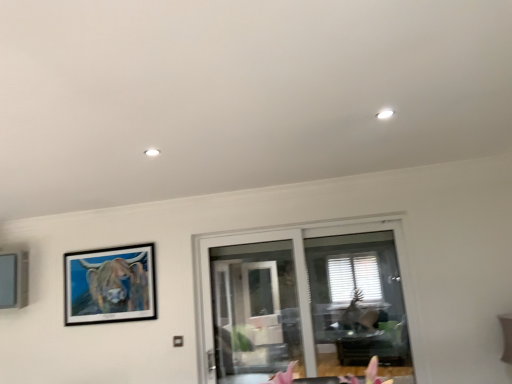
Question: Should I look upward or downward to see matte gray picture frame at left, which ranks as the second picture frame in right-to-left order?

Choices:
 (A) up
 (B) down

Answer: (B)

Question: From the image's perspective, is matte gray picture frame at left, which is the first picture frame in left-to-right order, above wooden-framed painting at upper left, marked as the 1th picture frame in a right-to-left arrangement?

Choices:
 (A) yes
 (B) no

Answer: (A)

Question: From a real-world perspective, is matte gray picture frame at left, which ranks as the second picture frame in right-to-left order, physically above wooden-framed painting at upper left, which ranks as the 2th picture frame in left-to-right order?

Choices:
 (A) no
 (B) yes

Answer: (B)

Question: Is matte gray picture frame at left, which is the first picture frame in left-to-right order, looking in the opposite direction of wooden-framed painting at upper left, marked as the 1th picture frame in a right-to-left arrangement?

Choices:
 (A) no
 (B) yes

Answer: (A)

Question: Is matte gray picture frame at left, which is the first picture frame in left-to-right order, at the right side of wooden-framed painting at upper left, marked as the 1th picture frame in a right-to-left arrangement?

Choices:
 (A) no
 (B) yes

Answer: (A)

Question: Considering the relative positions of matte gray picture frame at left, which is the first picture frame in left-to-right order, and wooden-framed painting at upper left, which ranks as the 2th picture frame in left-to-right order, in the image provided, is matte gray picture frame at left, which is the first picture frame in left-to-right order, to the left of wooden-framed painting at upper left, which ranks as the 2th picture frame in left-to-right order, from the viewer's perspective?

Choices:
 (A) no
 (B) yes

Answer: (B)

Question: Can we say matte gray picture frame at left, which ranks as the second picture frame in right-to-left order, lies outside wooden-framed painting at upper left, marked as the 1th picture frame in a right-to-left arrangement?

Choices:
 (A) no
 (B) yes

Answer: (B)

Question: Considering the relative sizes of wooden-framed painting at upper left, which ranks as the 2th picture frame in left-to-right order, and matte gray picture frame at left, which is the first picture frame in left-to-right order, in the image provided, is wooden-framed painting at upper left, which ranks as the 2th picture frame in left-to-right order, bigger than matte gray picture frame at left, which is the first picture frame in left-to-right order,?

Choices:
 (A) yes
 (B) no

Answer: (B)

Question: Is wooden-framed painting at upper left, marked as the 1th picture frame in a right-to-left arrangement, thinner than matte gray picture frame at left, which is the first picture frame in left-to-right order?

Choices:
 (A) yes
 (B) no

Answer: (A)

Question: Is wooden-framed painting at upper left, which ranks as the 2th picture frame in left-to-right order, at the right side of matte gray picture frame at left, which is the first picture frame in left-to-right order?

Choices:
 (A) yes
 (B) no

Answer: (A)

Question: Considering the relative positions of wooden-framed painting at upper left, which ranks as the 2th picture frame in left-to-right order, and matte gray picture frame at left, which is the first picture frame in left-to-right order, in the image provided, is wooden-framed painting at upper left, which ranks as the 2th picture frame in left-to-right order, to the left of matte gray picture frame at left, which is the first picture frame in left-to-right order, from the viewer's perspective?

Choices:
 (A) no
 (B) yes

Answer: (A)

Question: Considering the relative sizes of wooden-framed painting at upper left, marked as the 1th picture frame in a right-to-left arrangement, and matte gray picture frame at left, which is the first picture frame in left-to-right order, in the image provided, is wooden-framed painting at upper left, marked as the 1th picture frame in a right-to-left arrangement, smaller than matte gray picture frame at left, which is the first picture frame in left-to-right order,?

Choices:
 (A) yes
 (B) no

Answer: (A)

Question: Is matte gray picture frame at left, which ranks as the second picture frame in right-to-left order, inside wooden-framed painting at upper left, marked as the 1th picture frame in a right-to-left arrangement?

Choices:
 (A) no
 (B) yes

Answer: (A)

Question: Does transparent glass door at center have a larger size compared to wooden-framed painting at upper left, marked as the 1th picture frame in a right-to-left arrangement?

Choices:
 (A) yes
 (B) no

Answer: (A)